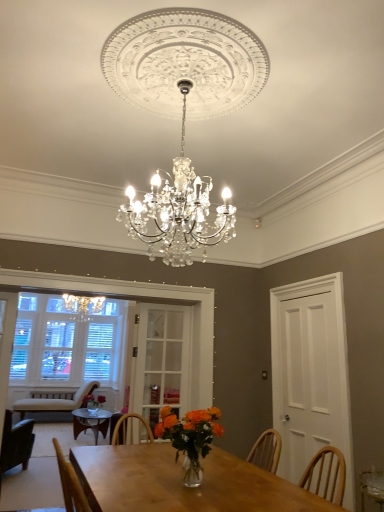
Question: From the image's perspective, does dark green fabric chair at left, the 2th chair from the back, appear lower than clear glass door at center, which appears as the 2th glass door when viewed from the right?

Choices:
 (A) no
 (B) yes

Answer: (B)

Question: From the image's perspective, is dark green fabric chair at left, the 2th chair when ordered from bottom to top, located above clear glass door at center, which appears as the first glass door when viewed from the left?

Choices:
 (A) yes
 (B) no

Answer: (B)

Question: Considering the relative sizes of dark green fabric chair at left, which appears as the first chair when viewed from the front, and clear glass door at center, which appears as the first glass door when viewed from the left, in the image provided, is dark green fabric chair at left, which appears as the first chair when viewed from the front, smaller than clear glass door at center, which appears as the first glass door when viewed from the left,?

Choices:
 (A) no
 (B) yes

Answer: (A)

Question: Does dark green fabric chair at left, the 1th chair viewed from the top, touch clear glass door at center, which appears as the 2th glass door when viewed from the right?

Choices:
 (A) yes
 (B) no

Answer: (B)

Question: Would you say dark green fabric chair at left, the 2th chair when ordered from bottom to top, is a long distance from clear glass door at center, which appears as the 2th glass door when viewed from the right?

Choices:
 (A) no
 (B) yes

Answer: (B)

Question: Is dark green fabric chair at left, which appears as the first chair when viewed from the front, to the left of clear glass door at center, which appears as the first glass door when viewed from the left, from the viewer's perspective?

Choices:
 (A) yes
 (B) no

Answer: (A)

Question: Considering the relative sizes of dark green fabric chair at left, the 1th chair viewed from the top, and translucent glass vase at center in the image provided, is dark green fabric chair at left, the 1th chair viewed from the top, thinner than translucent glass vase at center?

Choices:
 (A) yes
 (B) no

Answer: (B)

Question: Is dark green fabric chair at left, the 2th chair from the back, outside translucent glass vase at center?

Choices:
 (A) no
 (B) yes

Answer: (B)

Question: Does dark green fabric chair at left, the 1th chair viewed from the top, have a greater height compared to translucent glass vase at center?

Choices:
 (A) no
 (B) yes

Answer: (B)

Question: Can you confirm if dark green fabric chair at left, the 2th chair when ordered from bottom to top, is smaller than translucent glass vase at center?

Choices:
 (A) no
 (B) yes

Answer: (A)

Question: From a real-world perspective, is dark green fabric chair at left, the 2th chair when ordered from bottom to top, on top of translucent glass vase at center?

Choices:
 (A) no
 (B) yes

Answer: (A)

Question: From the image's perspective, is dark green fabric chair at left, which appears as the first chair when viewed from the front, below translucent glass vase at center?

Choices:
 (A) no
 (B) yes

Answer: (B)

Question: Is the position of white wood door at right, placed as the 1th glass door when sorted from right to left, less distant than that of clear glass door at center, which appears as the 2th glass door when viewed from the right?

Choices:
 (A) no
 (B) yes

Answer: (B)